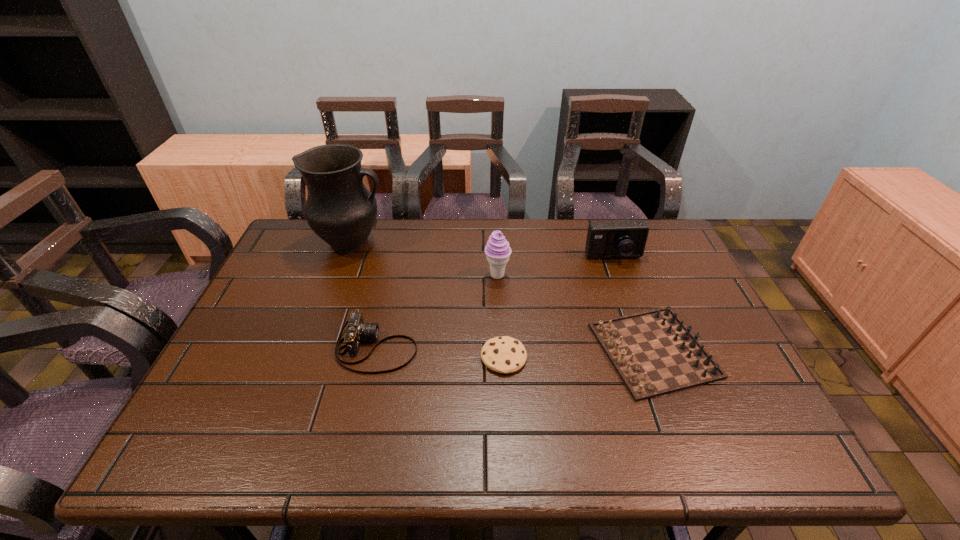
I want to click on object that is at the far left corner, so click(339, 209).

Find the location of a particular element. object located at the far right corner is located at coordinates (621, 239).

In order to click on free point at the far edge in this screenshot , I will do `click(477, 259)`.

I want to click on free space at the near edge, so click(542, 445).

Find the location of `vacant area at the left edge of the desktop`. vacant area at the left edge of the desktop is located at coordinates (313, 283).

Find the location of a particular element. Image resolution: width=960 pixels, height=540 pixels. blank space at the right edge of the desktop is located at coordinates (761, 409).

The width and height of the screenshot is (960, 540). In order to click on vacant space at the far left corner of the desktop in this screenshot , I will do `click(309, 252)`.

At what (x,y) coordinates should I click in order to perform the action: click on free space between the farther camera and the chessboard. Please return your answer as a coordinate pair (x, y). Looking at the image, I should click on pyautogui.click(x=634, y=304).

Where is `empty location between the nearer camera and the fifth shortest object`? empty location between the nearer camera and the fifth shortest object is located at coordinates (437, 311).

The width and height of the screenshot is (960, 540). What are the coordinates of `empty location between the shortest object and the fifth shortest object` in the screenshot? It's located at (500, 316).